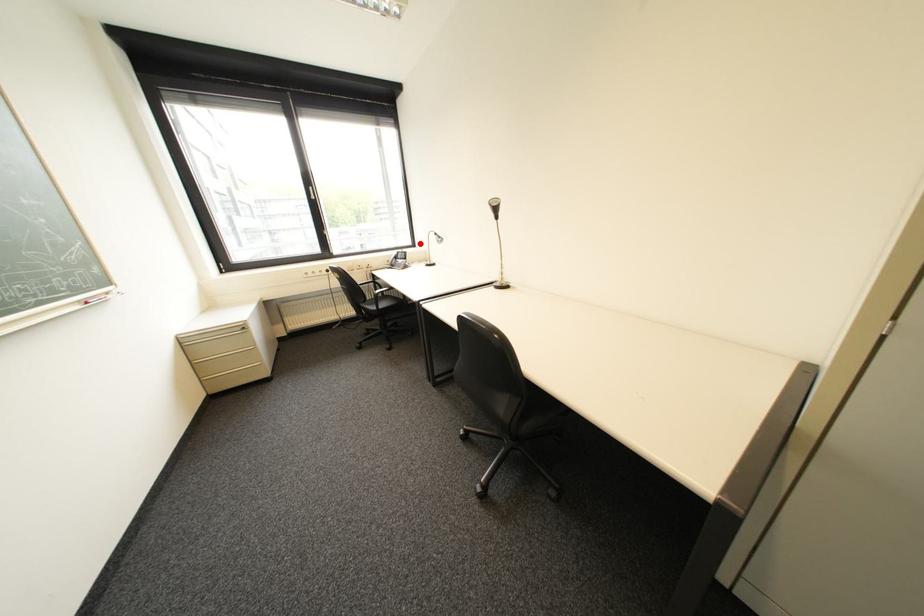
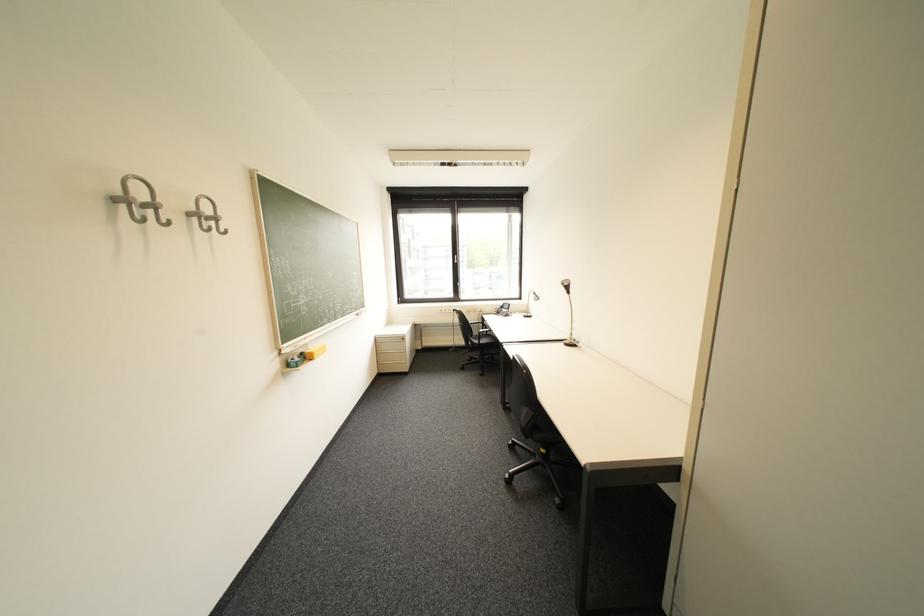
Question: I am providing you with two images of the same scene from different viewpoints. A red point is shown in image1. For the corresponding object point in image2, is it positioned nearer or farther from the camera?

Choices:
 (A) Nearer
 (B) Farther

Answer: (B)